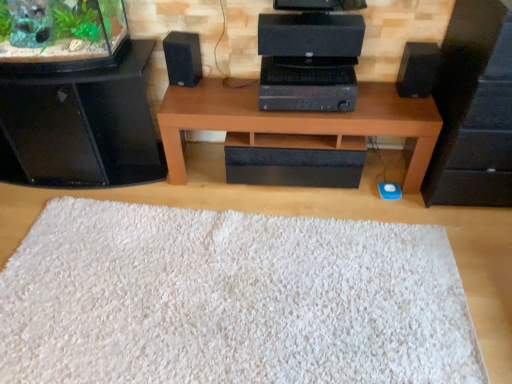
Question: Is black matte speaker at left, placed as the first speaker when sorted from left to right, positioned beyond the bounds of green matte plant at upper left?

Choices:
 (A) yes
 (B) no

Answer: (A)

Question: Does black matte speaker at left, placed as the first speaker when sorted from left to right, have a lesser width compared to green matte plant at upper left?

Choices:
 (A) no
 (B) yes

Answer: (B)

Question: Can you confirm if black matte speaker at left, placed as the first speaker when sorted from left to right, is positioned to the right of green matte plant at upper left?

Choices:
 (A) no
 (B) yes

Answer: (B)

Question: Is black matte speaker at left, placed as the first speaker when sorted from left to right, positioned behind green matte plant at upper left?

Choices:
 (A) yes
 (B) no

Answer: (A)

Question: Is black matte speaker at left, placed as the first speaker when sorted from left to right, positioned in front of green matte plant at upper left?

Choices:
 (A) yes
 (B) no

Answer: (B)

Question: Does brown wood table at center turn towards black glossy speaker at left, arranged as the 1th furniture when viewed from the left?

Choices:
 (A) yes
 (B) no

Answer: (B)

Question: From the image's perspective, does brown wood table at center appear lower than black glossy speaker at left, which appears as the second furniture when viewed from the right?

Choices:
 (A) no
 (B) yes

Answer: (B)

Question: Can you confirm if brown wood table at center is positioned to the left of black glossy speaker at left, which appears as the second furniture when viewed from the right?

Choices:
 (A) yes
 (B) no

Answer: (B)

Question: Can you confirm if brown wood table at center is taller than black glossy speaker at left, which appears as the second furniture when viewed from the right?

Choices:
 (A) yes
 (B) no

Answer: (B)

Question: From the image's perspective, is brown wood table at center on top of black glossy speaker at left, which appears as the second furniture when viewed from the right?

Choices:
 (A) yes
 (B) no

Answer: (B)

Question: Is brown wood table at center oriented away from black glossy speaker at left, arranged as the 1th furniture when viewed from the left?

Choices:
 (A) no
 (B) yes

Answer: (A)

Question: Considering the relative sizes of brown wood table at center and black matte speaker at left, placed as the first speaker when sorted from left to right, in the image provided, is brown wood table at center smaller than black matte speaker at left, placed as the first speaker when sorted from left to right,?

Choices:
 (A) yes
 (B) no

Answer: (B)